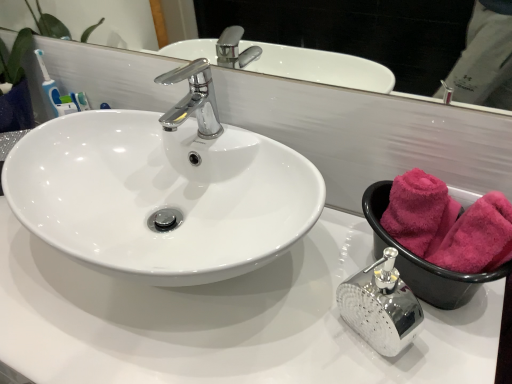
Find the location of a particular element. vacant space that's between white glossy sink at center and pink soft towel at right is located at coordinates (353, 307).